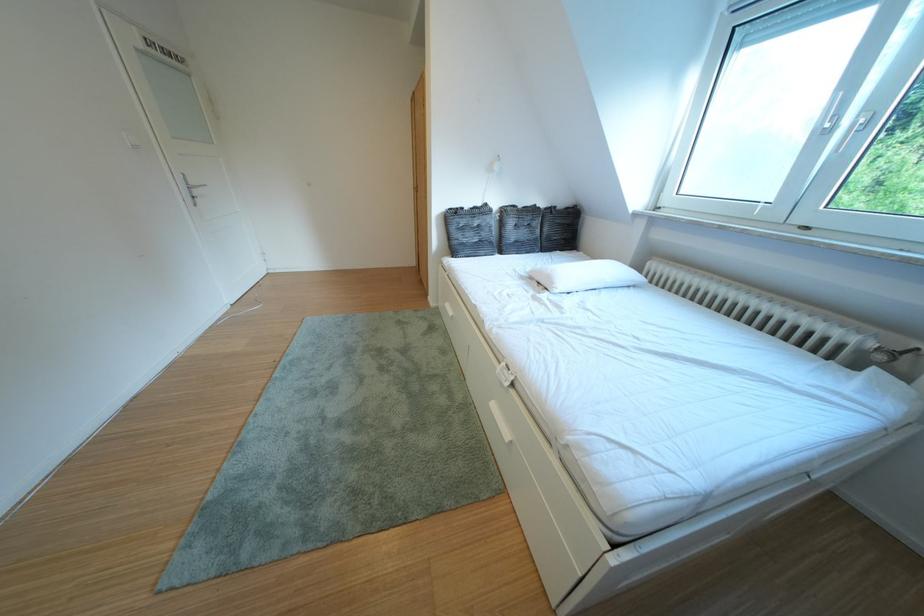
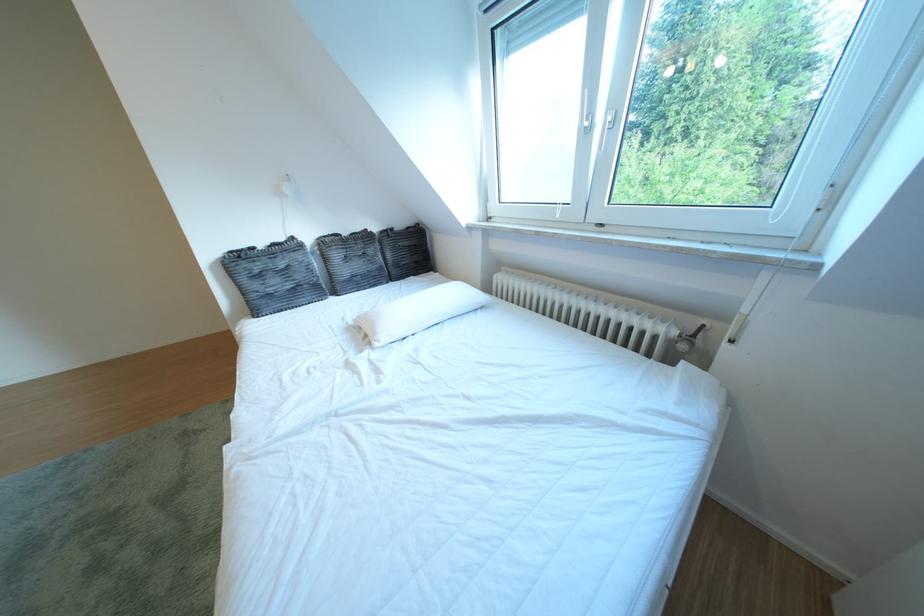
In a continuous first-person perspective shot, in which direction is the camera moving?

The cameraman moved toward right, forward.